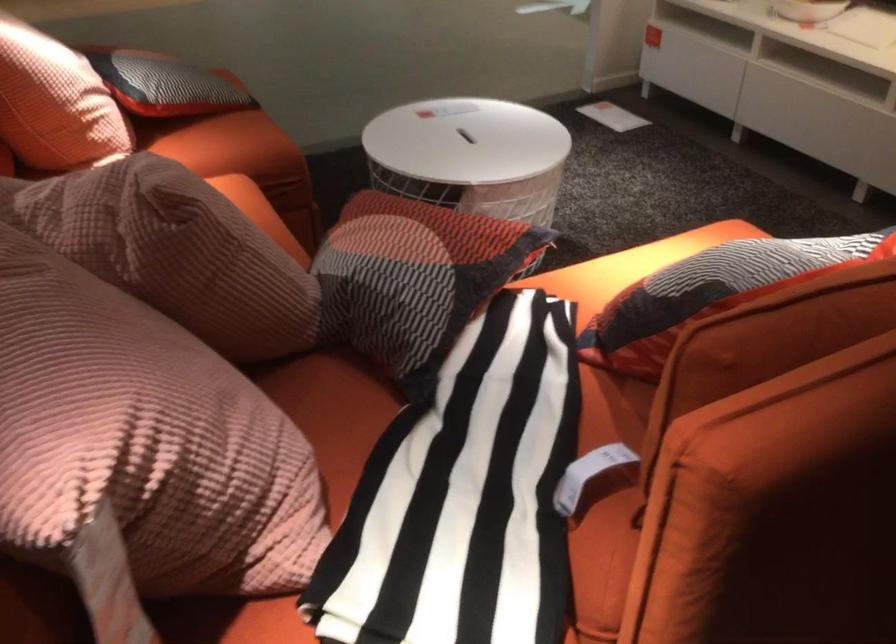
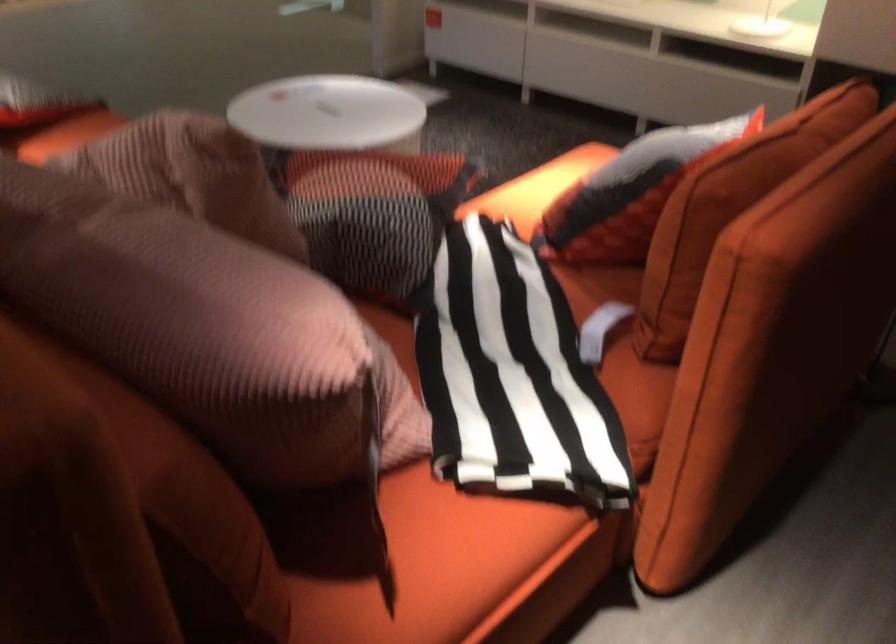
The point at (737, 381) is marked in the first image. Where is the corresponding point in the second image?

(730, 207)